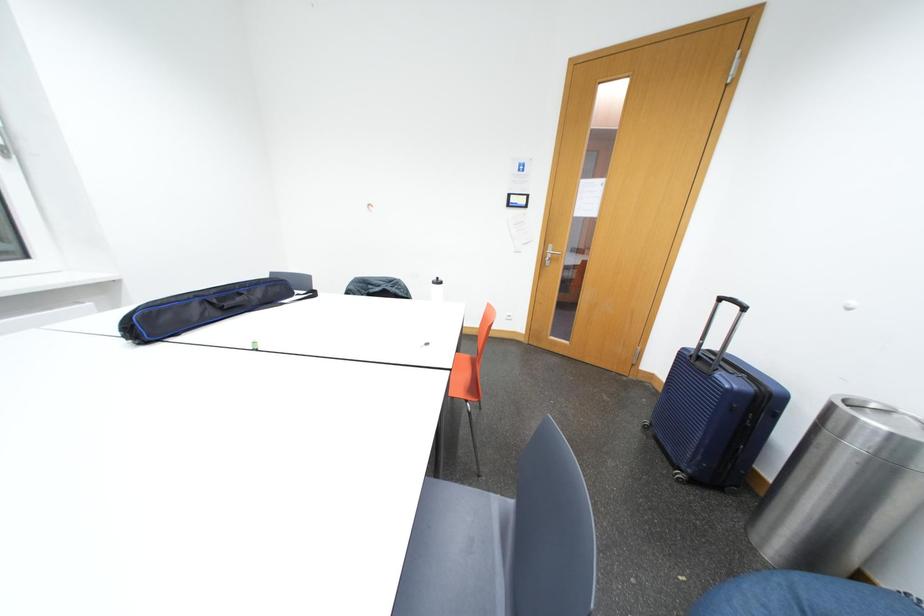
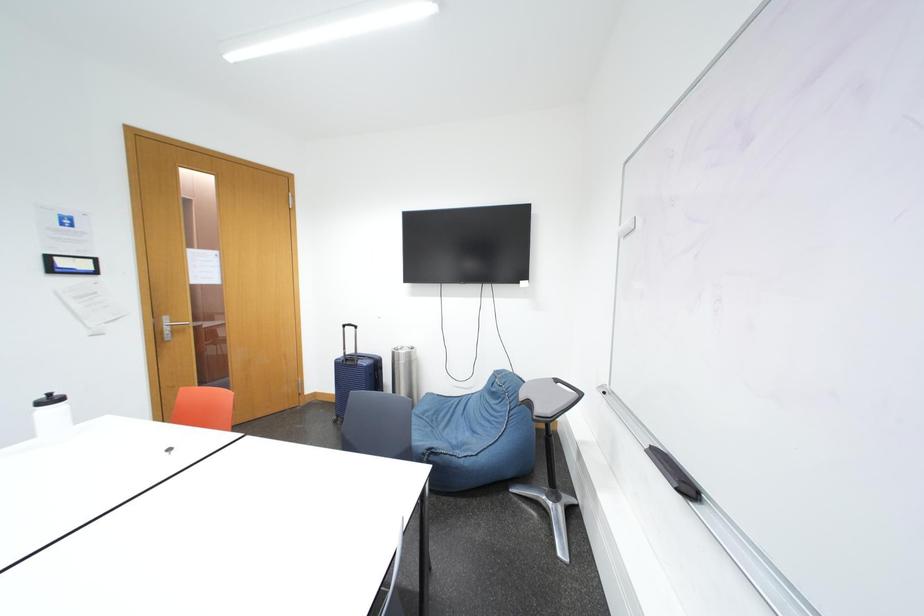
Question: How did the camera likely rotate?

Choices:
 (A) Left
 (B) Right
 (C) Up
 (D) Down

Answer: (B)